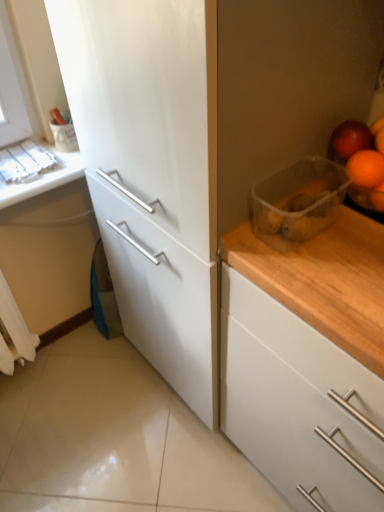
Question: Is wooden countertop at right looking in the opposite direction of white matte counter top at upper left?

Choices:
 (A) no
 (B) yes

Answer: (A)

Question: From a real-world perspective, is wooden countertop at right located higher than white matte counter top at upper left?

Choices:
 (A) yes
 (B) no

Answer: (B)

Question: From the image's perspective, does wooden countertop at right appear lower than white matte counter top at upper left?

Choices:
 (A) no
 (B) yes

Answer: (B)

Question: Is wooden countertop at right oriented towards white matte counter top at upper left?

Choices:
 (A) no
 (B) yes

Answer: (A)

Question: Considering the relative positions of wooden countertop at right and white matte counter top at upper left in the image provided, is wooden countertop at right in front of white matte counter top at upper left?

Choices:
 (A) no
 (B) yes

Answer: (B)

Question: Would you say transparent plastic container at upper right is inside or outside white matte counter top at upper left?

Choices:
 (A) outside
 (B) inside

Answer: (A)

Question: From the image's perspective, is transparent plastic container at upper right positioned above or below white matte counter top at upper left?

Choices:
 (A) below
 (B) above

Answer: (A)

Question: From a real-world perspective, is transparent plastic container at upper right positioned above or below white matte counter top at upper left?

Choices:
 (A) above
 (B) below

Answer: (A)

Question: Is transparent plastic container at upper right taller or shorter than white matte counter top at upper left?

Choices:
 (A) tall
 (B) short

Answer: (A)

Question: Based on their sizes in the image, would you say white fabric curtain at lower left is bigger or smaller than transparent plastic container at upper right?

Choices:
 (A) small
 (B) big

Answer: (B)

Question: Considering the positions of point (21, 320) and point (278, 239), is point (21, 320) closer or farther from the camera than point (278, 239)?

Choices:
 (A) closer
 (B) farther

Answer: (B)

Question: From the image's perspective, relative to transparent plastic container at upper right, is white fabric curtain at lower left above or below?

Choices:
 (A) above
 (B) below

Answer: (B)

Question: Would you say white fabric curtain at lower left is to the left or to the right of transparent plastic container at upper right in the picture?

Choices:
 (A) right
 (B) left

Answer: (B)

Question: Is white fabric curtain at lower left in front of or behind orange matte plastic at upper right in the image?

Choices:
 (A) front
 (B) behind

Answer: (B)

Question: From the image's perspective, is white fabric curtain at lower left positioned above or below orange matte plastic at upper right?

Choices:
 (A) below
 (B) above

Answer: (A)